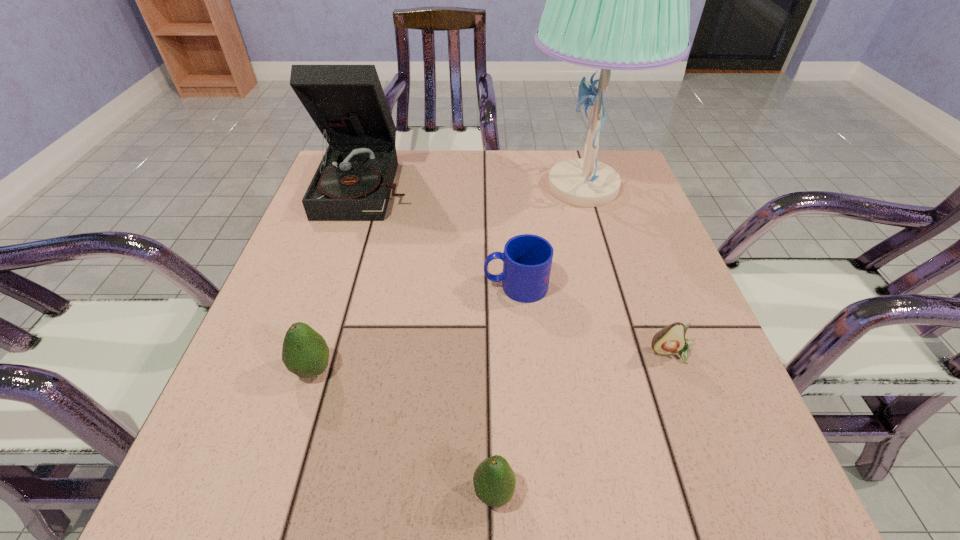
Locate an element on the screen. This screenshot has height=540, width=960. free space located 0.370m on the side with the handle of the mug is located at coordinates (299, 286).

You are a GUI agent. You are given a task and a screenshot of the screen. Output one action in this format:
    pyautogui.click(x=<x>, y=<y>)
    Task: Click on the vacant region located on the side with the handle of the mug
    
    Given the screenshot: What is the action you would take?
    point(378,286)

The image size is (960, 540). I want to click on free space located on the side with the handle of the mug, so point(308,286).

At what (x,y) coordinates should I click in order to perform the action: click on vacant point located on the seed side of the rightmost avocado. Please return your answer as a coordinate pair (x, y). Looking at the image, I should click on (685, 390).

You are a GUI agent. You are given a task and a screenshot of the screen. Output one action in this format:
    pyautogui.click(x=<x>, y=<y>)
    Task: Click on the vacant position located on the left of the nearest avocado
    This screenshot has height=540, width=960.
    Given the screenshot: What is the action you would take?
    pyautogui.click(x=321, y=492)

Where is `lamp at the far edge`? lamp at the far edge is located at coordinates (616, 0).

You are a GUI agent. You are given a task and a screenshot of the screen. Output one action in this format:
    pyautogui.click(x=<x>, y=<y>)
    Task: Click on the phonograph_record positioned at the far edge
    The width and height of the screenshot is (960, 540).
    Given the screenshot: What is the action you would take?
    pyautogui.click(x=353, y=182)

Where is `object present at the near edge`? The width and height of the screenshot is (960, 540). object present at the near edge is located at coordinates coord(494,481).

Identify the location of phonograph_record situated at the left edge. (353, 182).

I want to click on avocado situated at the left edge, so click(305, 353).